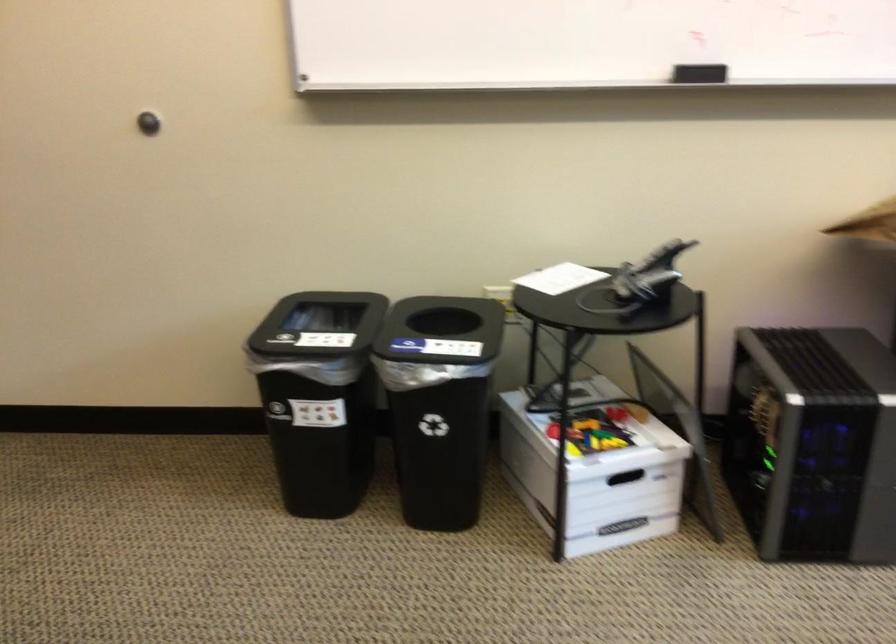
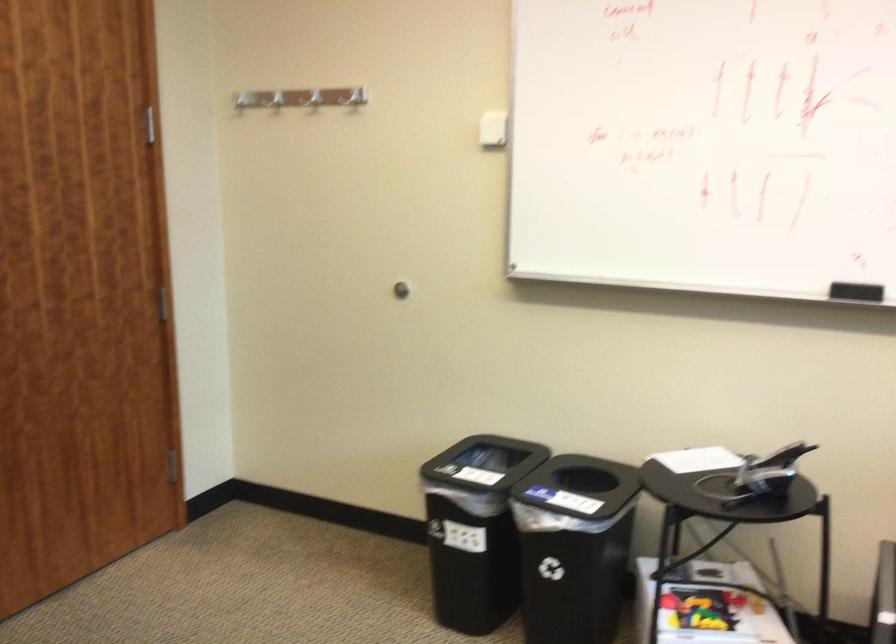
Where in the second image is the point corresponding to the point at 666,259 from the first image?

(782, 456)